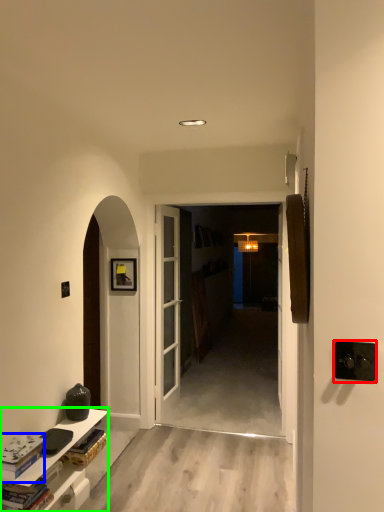
Question: Estimate the real-world distances between objects in this image. Which object is farther from door handle (highlighted by a red box), book (highlighted by a blue box) or cabinetry (highlighted by a green box)?

Choices:
 (A) book
 (B) cabinetry

Answer: (B)